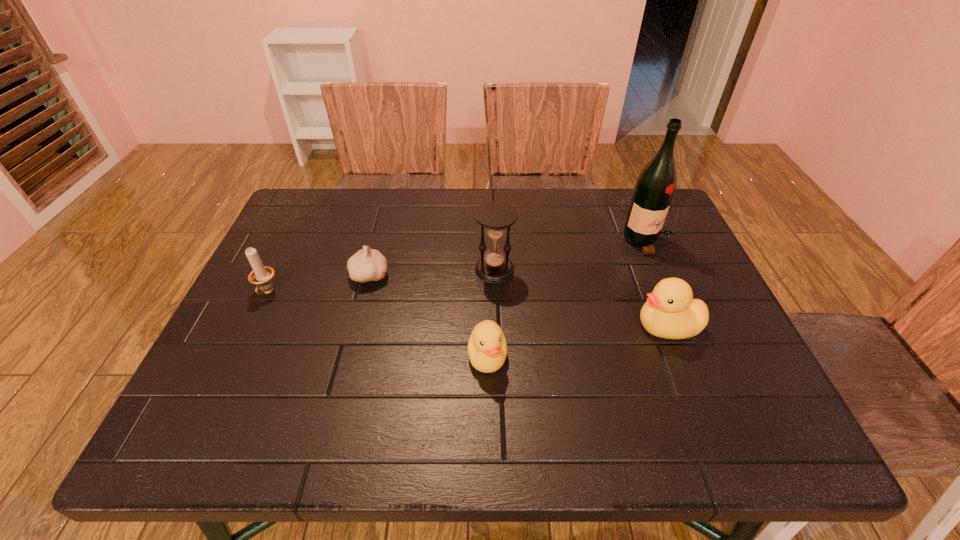
Observe the arrangement of all ducks in the image. To keep them evenly spaced, where would you place another duck on the left? Please locate a free space. Please provide its 2D coordinates. Your answer should be formatted as a tuple, i.e. [(x, y)], where the tuple contains the x and y coordinates of a point satisfying the conditions above.

[(284, 390)]